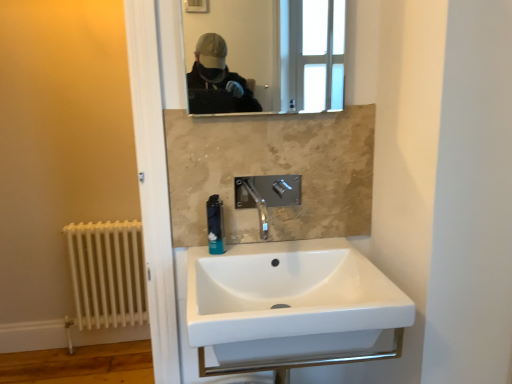
Question: Are white ceramic sink at center and white painted metal radiator at lower left far apart?

Choices:
 (A) no
 (B) yes

Answer: (B)

Question: Is white ceramic sink at center closer to camera compared to white painted metal radiator at lower left?

Choices:
 (A) yes
 (B) no

Answer: (A)

Question: Is white ceramic sink at center aimed at white painted metal radiator at lower left?

Choices:
 (A) no
 (B) yes

Answer: (A)

Question: Can white painted metal radiator at lower left be found inside white ceramic sink at center?

Choices:
 (A) yes
 (B) no

Answer: (B)

Question: Is white ceramic sink at center not within white painted metal radiator at lower left?

Choices:
 (A) no
 (B) yes

Answer: (B)

Question: Considering the positions of white painted metal radiator at lower left and white ceramic sink at center in the image, is white painted metal radiator at lower left taller or shorter than white ceramic sink at center?

Choices:
 (A) tall
 (B) short

Answer: (A)

Question: Is point (122, 297) closer or farther from the camera than point (231, 306)?

Choices:
 (A) farther
 (B) closer

Answer: (A)

Question: Is white painted metal radiator at lower left inside or outside of white ceramic sink at center?

Choices:
 (A) inside
 (B) outside

Answer: (B)

Question: In terms of width, does white painted metal radiator at lower left look wider or thinner when compared to white ceramic sink at center?

Choices:
 (A) thin
 (B) wide

Answer: (A)

Question: Is matte glass mirror at upper center bigger or smaller than blue plastic soap dispenser at center?

Choices:
 (A) big
 (B) small

Answer: (A)

Question: From the image's perspective, is matte glass mirror at upper center above or below blue plastic soap dispenser at center?

Choices:
 (A) below
 (B) above

Answer: (B)

Question: Based on their positions, is matte glass mirror at upper center located to the left or right of blue plastic soap dispenser at center?

Choices:
 (A) right
 (B) left

Answer: (A)

Question: Is matte glass mirror at upper center inside the boundaries of blue plastic soap dispenser at center, or outside?

Choices:
 (A) outside
 (B) inside

Answer: (A)

Question: Considering their positions, is polished chrome faucet at center located in front of or behind white ceramic sink at center?

Choices:
 (A) front
 (B) behind

Answer: (B)

Question: Is point (270, 198) closer or farther from the camera than point (256, 185)?

Choices:
 (A) closer
 (B) farther

Answer: (A)